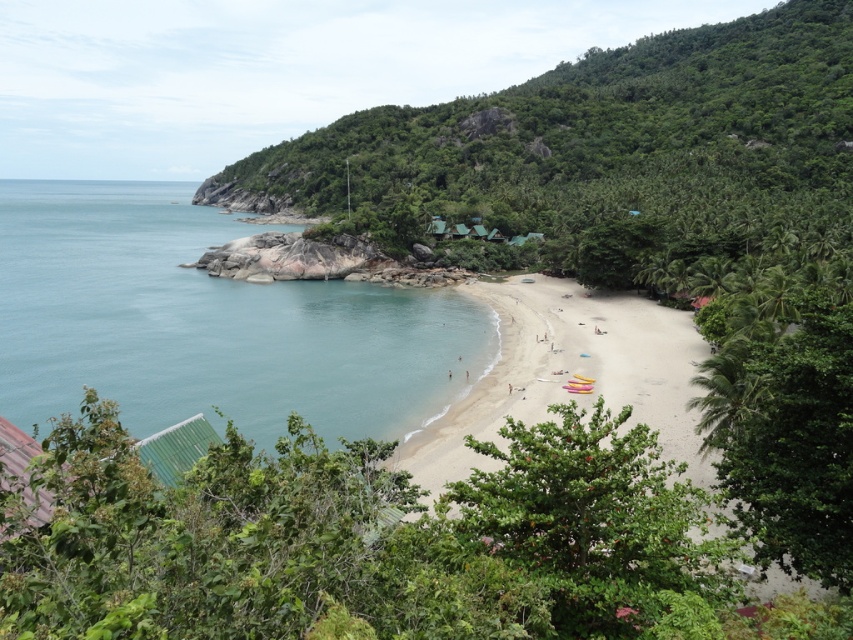
Can you confirm if green leafy bush at center is positioned to the left of light brown sand at center?

Yes, green leafy bush at center is to the left of light brown sand at center.

Does green leafy bush at center have a greater height compared to light brown sand at center?

No.

Is point (10, 528) positioned before point (648, 330)?

Yes, it is in front of point (648, 330).

Where is `green leafy bush at center`? Image resolution: width=853 pixels, height=640 pixels. green leafy bush at center is located at coordinates (376, 544).

Can you confirm if clear blue water at lower left is positioned to the right of light brown sand at center?

In fact, clear blue water at lower left is to the left of light brown sand at center.

Does clear blue water at lower left have a smaller size compared to light brown sand at center?

Actually, clear blue water at lower left might be larger than light brown sand at center.

Locate an element on the screen. The image size is (853, 640). clear blue water at lower left is located at coordinates (209, 323).

Is green leafy bush at center to the right of clear blue water at lower left from the viewer's perspective?

Indeed, green leafy bush at center is positioned on the right side of clear blue water at lower left.

Is green leafy bush at center smaller than clear blue water at lower left?

Yes.

Between point (665, 497) and point (375, 307), which one is positioned behind?

The point (375, 307) is behind.

Where is `green leafy bush at center`? The width and height of the screenshot is (853, 640). green leafy bush at center is located at coordinates (376, 544).